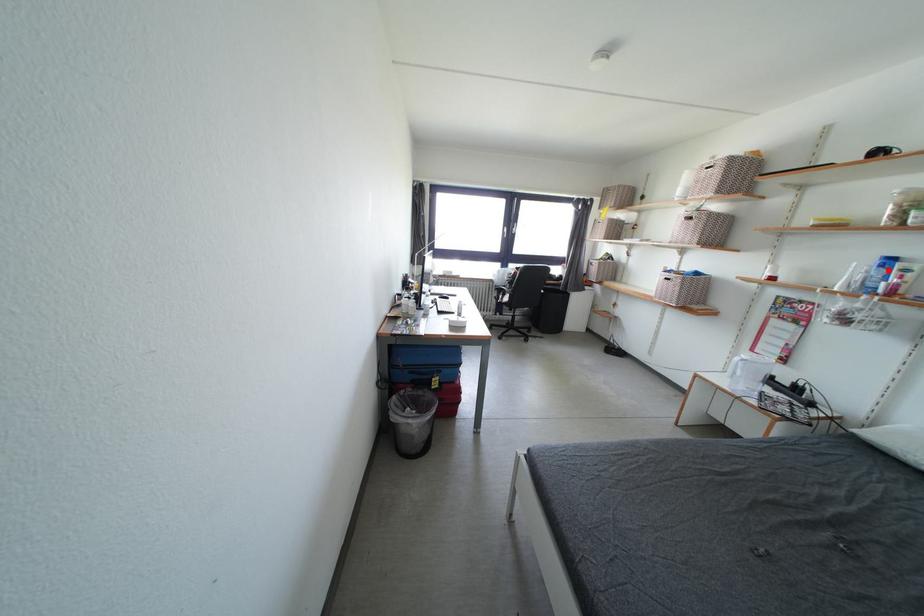
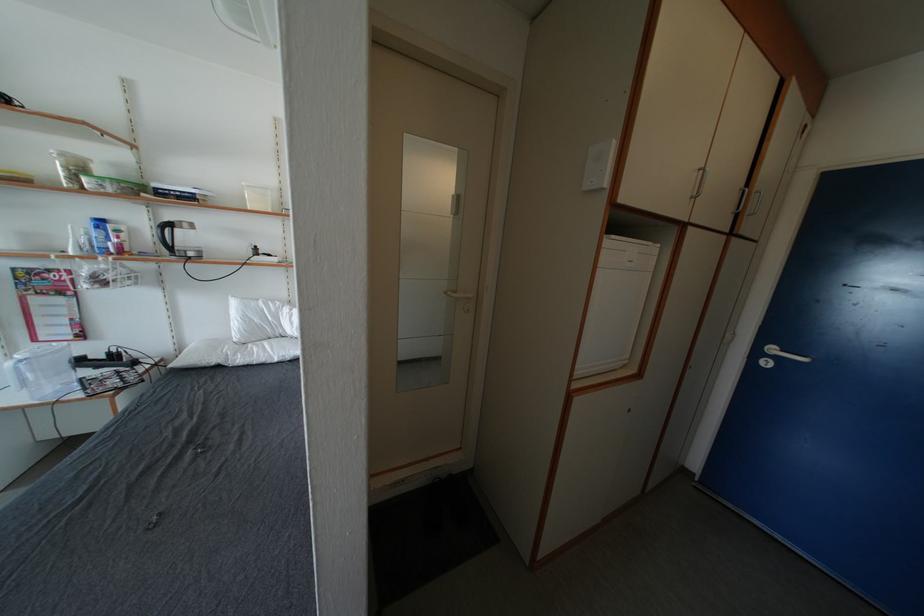
Find the pixel in the second image that matches the highlighted location in the first image.

(103, 232)